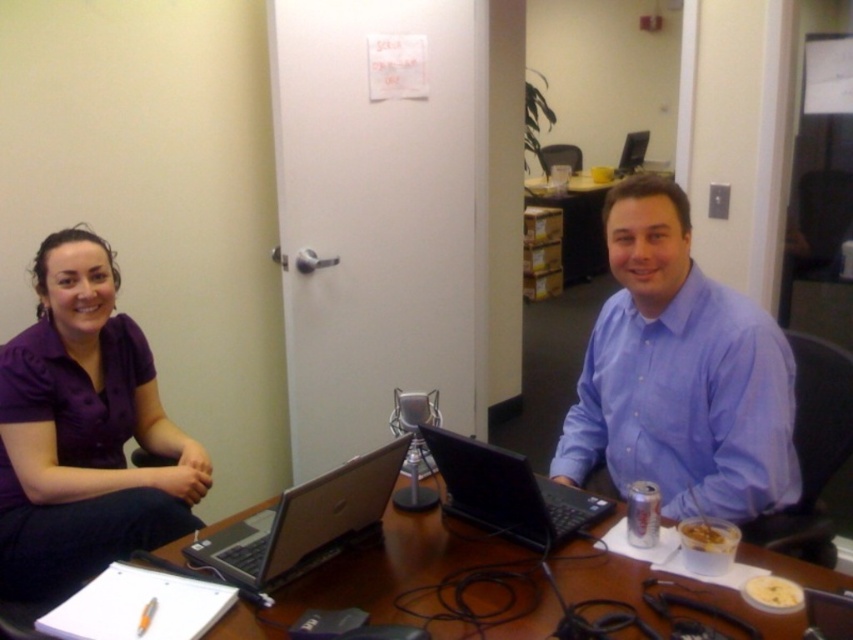
Can you confirm if blue button-down shirt at center is taller than purple fabric shirt at left?

In fact, blue button-down shirt at center may be shorter than purple fabric shirt at left.

In the scene shown: Who is lower down, blue button-down shirt at center or purple fabric shirt at left?

purple fabric shirt at left

Is point (614, 369) positioned behind point (157, 483)?

No, it is not.

Where is `blue button-down shirt at center`? blue button-down shirt at center is located at coordinates (679, 374).

Does wooden table at center have a lesser height compared to black matte laptop at center?

Incorrect, wooden table at center's height does not fall short of black matte laptop at center's.

Is wooden table at center in front of black matte laptop at center?

Yes.

Locate an element on the screen. wooden table at center is located at coordinates (474, 586).

This screenshot has width=853, height=640. What are the coordinates of `wooden table at center` in the screenshot? It's located at [x=474, y=586].

Which is above, blue button-down shirt at center or silver/black laptop at center?

blue button-down shirt at center

Is blue button-down shirt at center positioned in front of silver/black laptop at center?

No, it is not.

Image resolution: width=853 pixels, height=640 pixels. I want to click on blue button-down shirt at center, so click(679, 374).

I want to click on blue button-down shirt at center, so click(x=679, y=374).